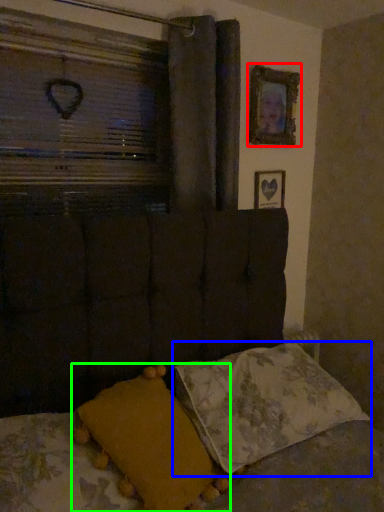
Question: Which object is positioned farthest from picture frame (highlighted by a red box)? Select from pillow (highlighted by a blue box) and pillow (highlighted by a green box).

Choices:
 (A) pillow
 (B) pillow

Answer: (B)